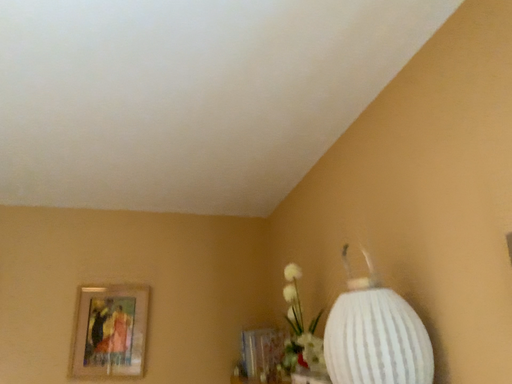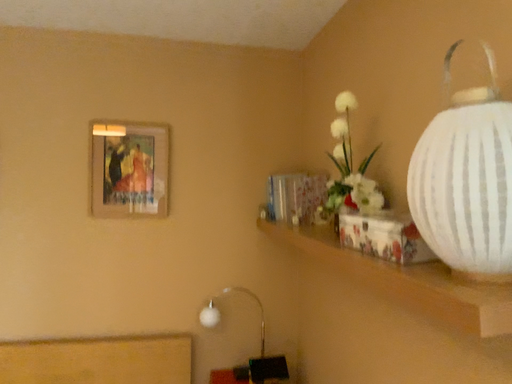
Question: How did the camera likely rotate when shooting the video?

Choices:
 (A) rotated downward
 (B) rotated upward

Answer: (A)